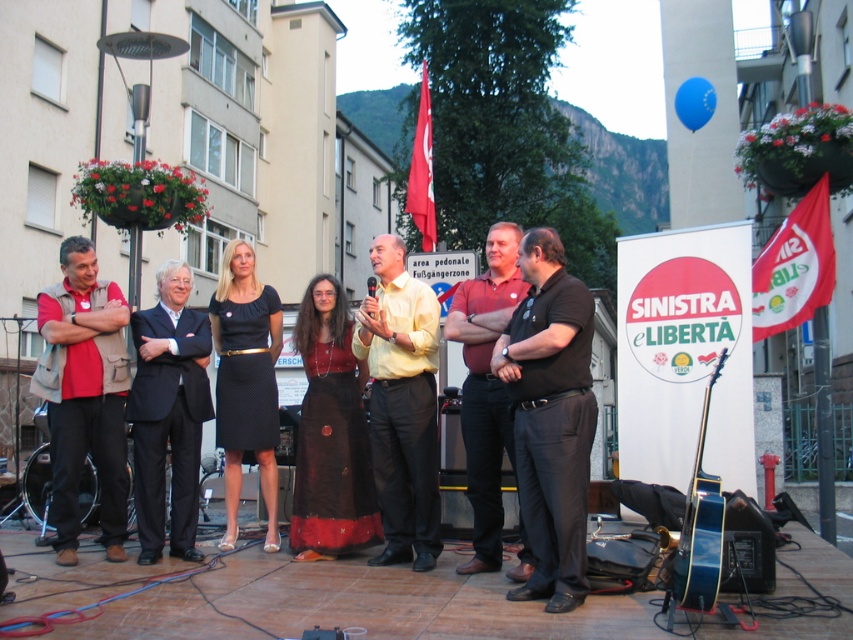
Is black smooth shirt at center bigger than matte red shirt at center?

No.

Which is in front, point (561, 257) or point (474, 524)?

Point (561, 257)

At what (x,y) coordinates should I click in order to perform the action: click on black smooth shirt at center. Please return your answer as a coordinate pair (x, y). This screenshot has height=640, width=853. Looking at the image, I should click on [550, 417].

Does matte red shirt at center have a greater width compared to blue glossy guitar at center right?

In fact, matte red shirt at center might be narrower than blue glossy guitar at center right.

Where is `matte red shirt at center`? This screenshot has width=853, height=640. matte red shirt at center is located at coordinates (486, 387).

Describe the element at coordinates (486, 387) in the screenshot. I see `matte red shirt at center` at that location.

Where is `matte red shirt at center`? The height and width of the screenshot is (640, 853). matte red shirt at center is located at coordinates (486, 387).

Who is lower down, black smooth shirt at center or black suit at center?

Positioned lower is black suit at center.

At what (x,y) coordinates should I click in order to perform the action: click on black smooth shirt at center. Please return your answer as a coordinate pair (x, y). Looking at the image, I should click on (550, 417).